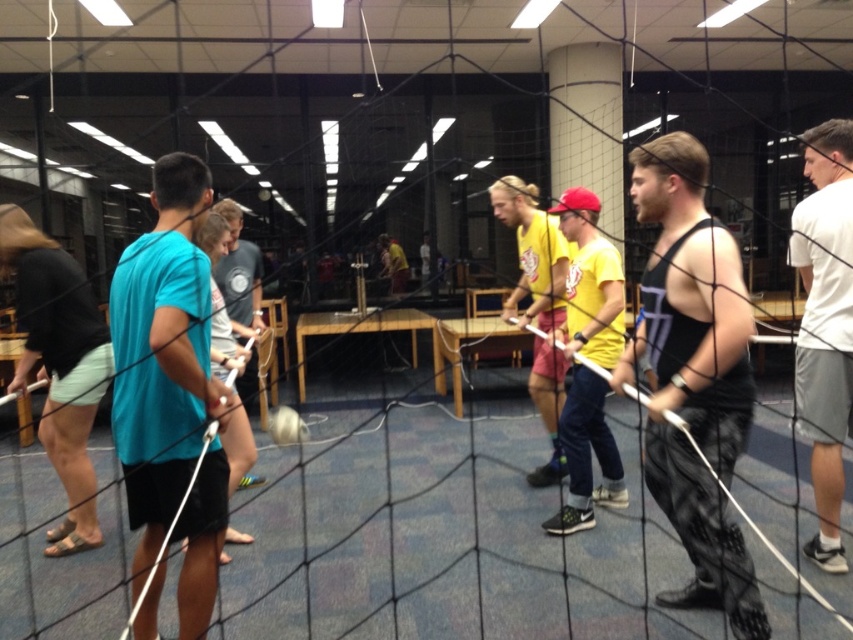
You are standing at the entrance of the room and want to locate the yellow cotton shirt at center. According to the coordinates provided, where should you look to find it?

The yellow cotton shirt at center is located at coordinates point (532, 252), which is in the lower middle section of the room.

You are organizing a team photo and need to arrange the participants in a line based on their shirt sizes. Given that you see the yellow cotton shirt at center and the light blue fabric shirt at center, which shirt should be placed first if you want to arrange them from largest to smallest?

The yellow cotton shirt at center should be placed first since it is larger than the light blue fabric shirt at center.